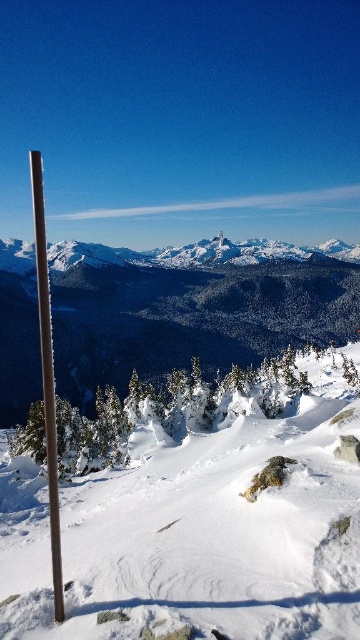
Can you confirm if snowy mountain at center is positioned above smooth brown pole at left?

No, snowy mountain at center is not above smooth brown pole at left.

Which is in front, point (96, 332) or point (43, 216)?

Point (96, 332) is more forward.

Locate an element on the screen. snowy mountain at center is located at coordinates (191, 308).

Can you confirm if white fluffy snow at center is wider than snowy mountain at center?

No, white fluffy snow at center is not wider than snowy mountain at center.

Between white fluffy snow at center and snowy mountain at center, which one has less height?

white fluffy snow at center is shorter.

You are a GUI agent. You are given a task and a screenshot of the screen. Output one action in this format:
    pyautogui.click(x=<x>, y=<y>)
    Task: Click on the white fluffy snow at center
    This screenshot has height=640, width=360.
    Given the screenshot: What is the action you would take?
    pyautogui.click(x=199, y=529)

Is white fluffy snow at center closer to the viewer compared to smooth brown pole at left?

Yes, it is.

The image size is (360, 640). Describe the element at coordinates (199, 529) in the screenshot. I see `white fluffy snow at center` at that location.

Where is `white fluffy snow at center`? This screenshot has height=640, width=360. white fluffy snow at center is located at coordinates (199, 529).